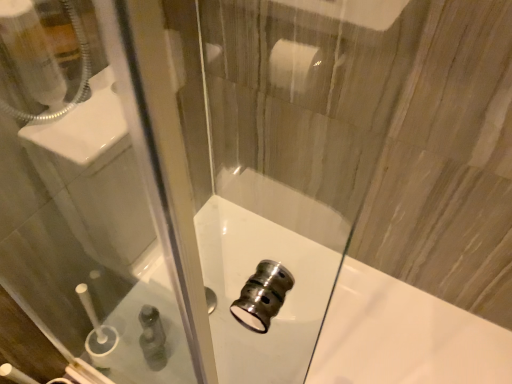
Identify the location of free spot to the left of green plastic bottle at lower left. The image size is (512, 384). (133, 350).